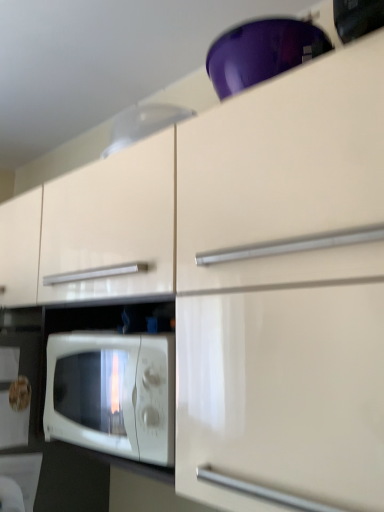
Question: Does white glossy exhaust hood at upper center have a larger size compared to white glossy microwave oven at lower left?

Choices:
 (A) yes
 (B) no

Answer: (B)

Question: Is white glossy exhaust hood at upper center not within white glossy microwave oven at lower left?

Choices:
 (A) yes
 (B) no

Answer: (A)

Question: Is white glossy exhaust hood at upper center positioned with its back to white glossy microwave oven at lower left?

Choices:
 (A) yes
 (B) no

Answer: (B)

Question: Is white glossy exhaust hood at upper center at the right side of white glossy microwave oven at lower left?

Choices:
 (A) yes
 (B) no

Answer: (A)

Question: Is white glossy exhaust hood at upper center positioned behind white glossy microwave oven at lower left?

Choices:
 (A) no
 (B) yes

Answer: (B)

Question: From a real-world perspective, is white glossy exhaust hood at upper center located higher than white glossy microwave oven at lower left?

Choices:
 (A) yes
 (B) no

Answer: (A)

Question: Considering the relative sizes of white glossy microwave oven at lower left and white glossy exhaust hood at upper center in the image provided, is white glossy microwave oven at lower left wider than white glossy exhaust hood at upper center?

Choices:
 (A) yes
 (B) no

Answer: (A)

Question: Can white glossy exhaust hood at upper center be found inside white glossy microwave oven at lower left?

Choices:
 (A) no
 (B) yes

Answer: (A)

Question: Is white glossy microwave oven at lower left at the left side of white glossy exhaust hood at upper center?

Choices:
 (A) yes
 (B) no

Answer: (A)

Question: Can you confirm if white glossy microwave oven at lower left is bigger than white glossy exhaust hood at upper center?

Choices:
 (A) yes
 (B) no

Answer: (A)

Question: From the image's perspective, is white glossy microwave oven at lower left beneath white glossy exhaust hood at upper center?

Choices:
 (A) no
 (B) yes

Answer: (B)

Question: Does white glossy microwave oven at lower left lie in front of white glossy exhaust hood at upper center?

Choices:
 (A) yes
 (B) no

Answer: (A)

Question: Considering the positions of white glossy microwave oven at lower left and white glossy exhaust hood at upper center in the image, is white glossy microwave oven at lower left wider or thinner than white glossy exhaust hood at upper center?

Choices:
 (A) thin
 (B) wide

Answer: (B)